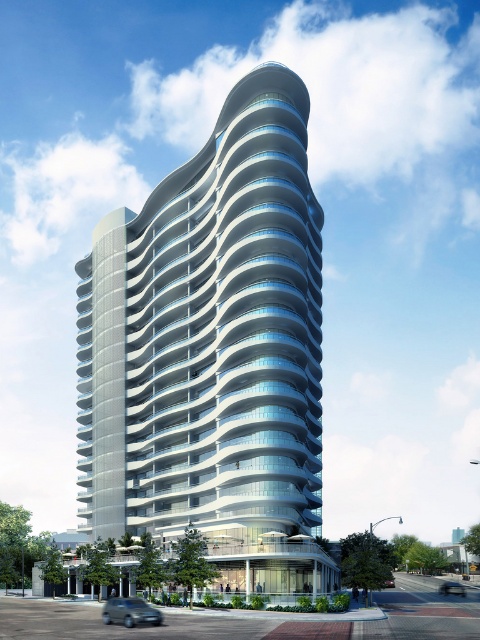
You are standing at the entrance of the white glass building at center and want to park your silver metallic car at lower right. Is the height of the building sufficient to avoid any potential collision with the car when entering the parking garage?

The white glass building at center is taller than the silver metallic car at lower right, so the height of the building is sufficient to avoid any potential collision with the car when entering the parking garage.

You are standing at a point 219.47 feet away from the high rise building. If you want to take a photo of the building, which part of the building will be in focus if you focus on the point at coordinates point (262,307)?

The point at coordinates point (262,307) is 219.47 feet away from the camera, so focusing on this point will ensure that the area of the building corresponding to those coordinates is in focus.